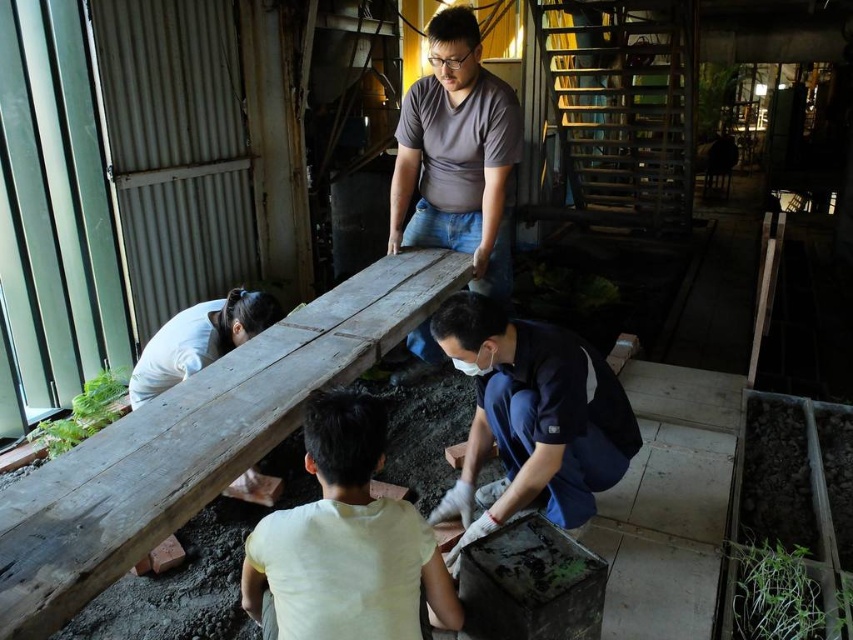
Which is more to the right, smooth concrete at center or matte brown wood plank at center?

Positioned to the right is smooth concrete at center.

Which is in front, point (619, 548) or point (479, 176)?

Point (619, 548) is more forward.

Locate an element on the screen. smooth concrete at center is located at coordinates (669, 502).

Is dark blue uniform at lower center to the left of green leafy plant at left from the viewer's perspective?

No, dark blue uniform at lower center is not to the left of green leafy plant at left.

Consider the image. Can you confirm if dark blue uniform at lower center is thinner than green leafy plant at left?

No, dark blue uniform at lower center is not thinner than green leafy plant at left.

Is point (503, 392) positioned before point (99, 378)?

Yes.

This screenshot has width=853, height=640. Identify the location of dark blue uniform at lower center. (531, 417).

Who is positioned more to the left, matte brown wood plank at center or green leafy plant at lower right?

From the viewer's perspective, matte brown wood plank at center appears more on the left side.

Can you confirm if matte brown wood plank at center is shorter than green leafy plant at lower right?

Incorrect, matte brown wood plank at center's height does not fall short of green leafy plant at lower right's.

Between point (440, 40) and point (750, 541), which one is positioned in front?

Positioned in front is point (750, 541).

Locate an element on the screen. The image size is (853, 640). matte brown wood plank at center is located at coordinates (456, 154).